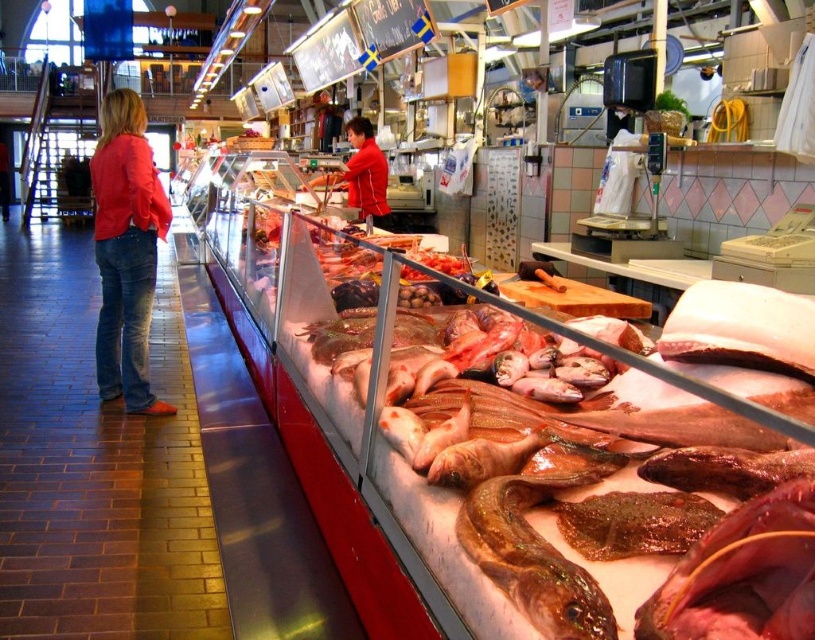
Does shiny red fish at center come behind shiny brown fish at center?

No, it is not.

This screenshot has height=640, width=815. In order to click on shiny red fish at center in this screenshot , I will do `click(742, 576)`.

What do you see at coordinates (742, 576) in the screenshot? This screenshot has width=815, height=640. I see `shiny red fish at center` at bounding box center [742, 576].

At what (x,y) coordinates should I click in order to perform the action: click on shiny red fish at center. Please return your answer as a coordinate pair (x, y). Looking at the image, I should click on (742, 576).

Is denim jeans at left thinner than matte red shirt at center?

Incorrect, denim jeans at left's width is not less than matte red shirt at center's.

This screenshot has width=815, height=640. What are the coordinates of `denim jeans at left` in the screenshot? It's located at pyautogui.click(x=126, y=250).

Can you confirm if shiny brown fish at center is thinner than matte red shirt at center?

Yes, shiny brown fish at center is thinner than matte red shirt at center.

Does shiny brown fish at center appear on the left side of matte red shirt at center?

No, shiny brown fish at center is not to the left of matte red shirt at center.

Does point (521, 545) come closer to viewer compared to point (346, 170)?

Yes.

Identify the location of shiny brown fish at center. (532, 556).